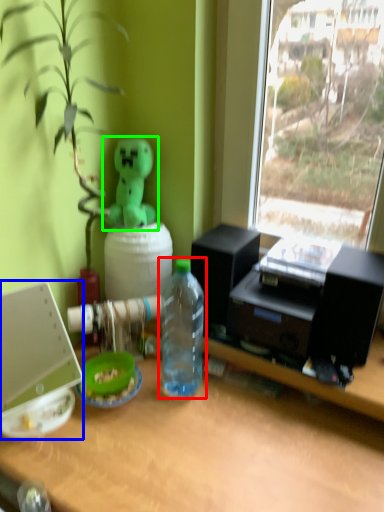
Question: Which is nearer to the bottle (highlighted by a red box)? laptop (highlighted by a blue box) or toy (highlighted by a green box).

Choices:
 (A) laptop
 (B) toy

Answer: (B)